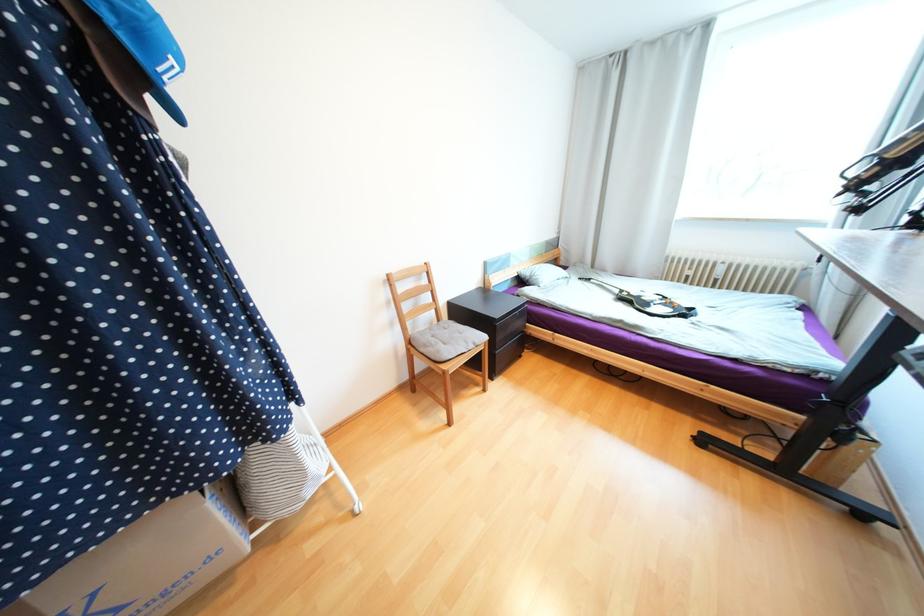
Find the location of `black electric guitar`. black electric guitar is located at coordinates (648, 302).